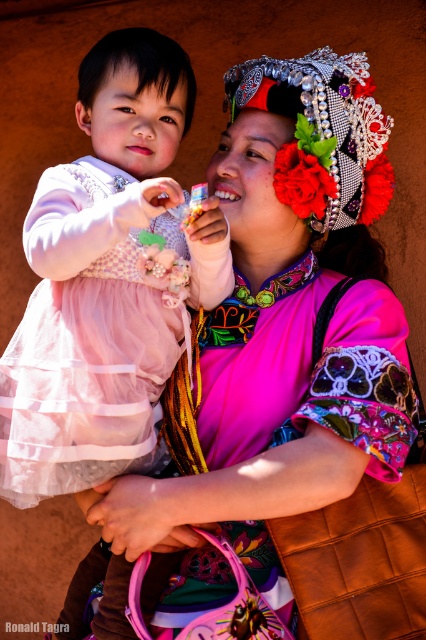
You are standing in front of the image and want to know which of the two points, point (94, 442) or point (350, 124), is nearer to you. Based on the scene described, can you determine which point is closer?

Point (94, 442) is closer to the viewer than point (350, 124).

You are a photographer setting up a shoot in this scene. You need to position a spotlight so that it illuminates both the matte pink dress at left and the silver metallic headdress at upper center. Considering their heights, which object should be placed on a higher stand to ensure both are equally lit?

The matte pink dress at left is much taller than the silver metallic headdress at upper center, so to ensure both are equally lit, the silver metallic headdress at upper center should be placed on a higher stand.

You are an observer standing in front of the image. You notice the matte pink dress at left and the silver metallic headdress at upper center. Which object is positioned further to the left?

The matte pink dress at left is positioned further to the left than the silver metallic headdress at upper center.